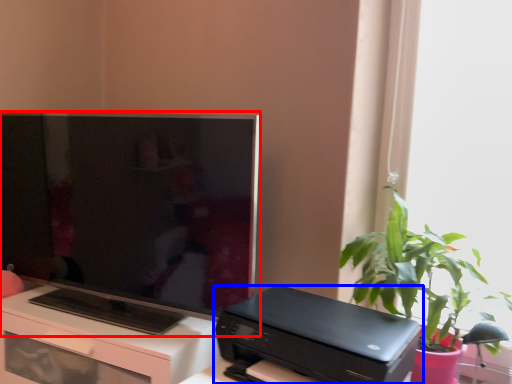
Question: Which of the following is the farthest to the observer, television (highlighted by a red box) or printer (highlighted by a blue box)?

Choices:
 (A) television
 (B) printer

Answer: (A)